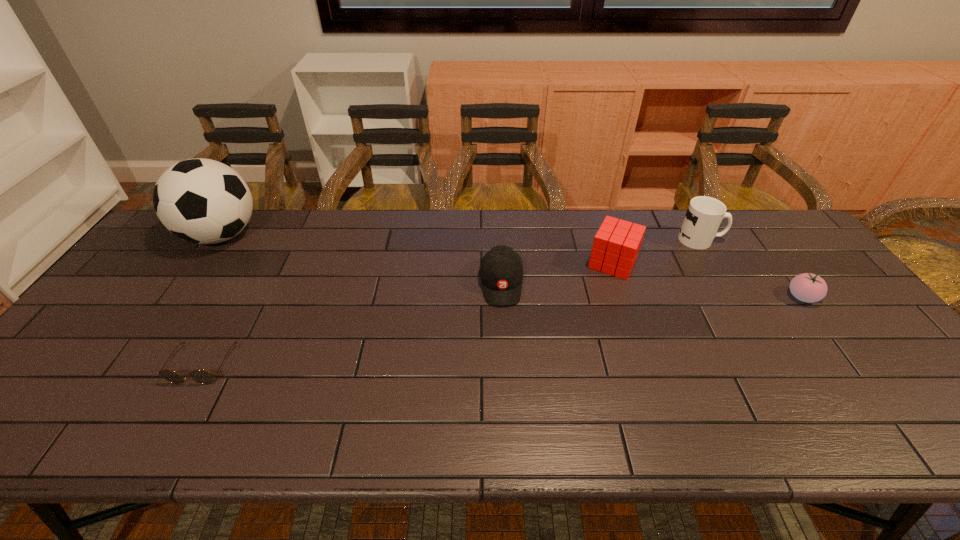
You are a GUI agent. You are given a task and a screenshot of the screen. Output one action in this format:
    pyautogui.click(x=<x>, y=<y>)
    Task: Click on the free space between the rightmost object and the fourth object from left to right
    Image resolution: width=960 pixels, height=540 pixels.
    Given the screenshot: What is the action you would take?
    pyautogui.click(x=708, y=280)

Image resolution: width=960 pixels, height=540 pixels. I want to click on unoccupied position between the fourth object from left to right and the mug, so click(657, 251).

Where is `free spot between the soccer ball and the fourth object from left to right`? The image size is (960, 540). free spot between the soccer ball and the fourth object from left to right is located at coordinates (417, 249).

Locate an element on the screen. vacant area that lies between the fifth object from left to right and the tomato is located at coordinates (751, 268).

Identify which object is the fifth nearest to the fourth object from left to right. Please provide its 2D coordinates. Your answer should be formatted as a tuple, i.e. [(x, y)], where the tuple contains the x and y coordinates of a point satisfying the conditions above.

[(203, 201)]

Locate which object ranks third in proximity to the fourth object from left to right. Please provide its 2D coordinates. Your answer should be formatted as a tuple, i.e. [(x, y)], where the tuple contains the x and y coordinates of a point satisfying the conditions above.

[(807, 287)]

Locate an element on the screen. free spot that satisfies the following two spatial constraints: 1. with a logo on the front of the baseball cap; 2. on the left side of the second shortest object is located at coordinates (502, 297).

This screenshot has width=960, height=540. Find the location of `vacant area that satisfies the following two spatial constraints: 1. on the front side of the rightmost object; 2. on the right side of the fourth object from left to right`. vacant area that satisfies the following two spatial constraints: 1. on the front side of the rightmost object; 2. on the right side of the fourth object from left to right is located at coordinates (624, 297).

Where is `vacant area in the image that satisfies the following two spatial constraints: 1. on the front side of the third object from right to left; 2. on the right side of the tallest object`? vacant area in the image that satisfies the following two spatial constraints: 1. on the front side of the third object from right to left; 2. on the right side of the tallest object is located at coordinates (203, 262).

This screenshot has height=540, width=960. I want to click on free space that satisfies the following two spatial constraints: 1. on the front side of the soccer ball; 2. on the right side of the rightmost object, so click(x=179, y=297).